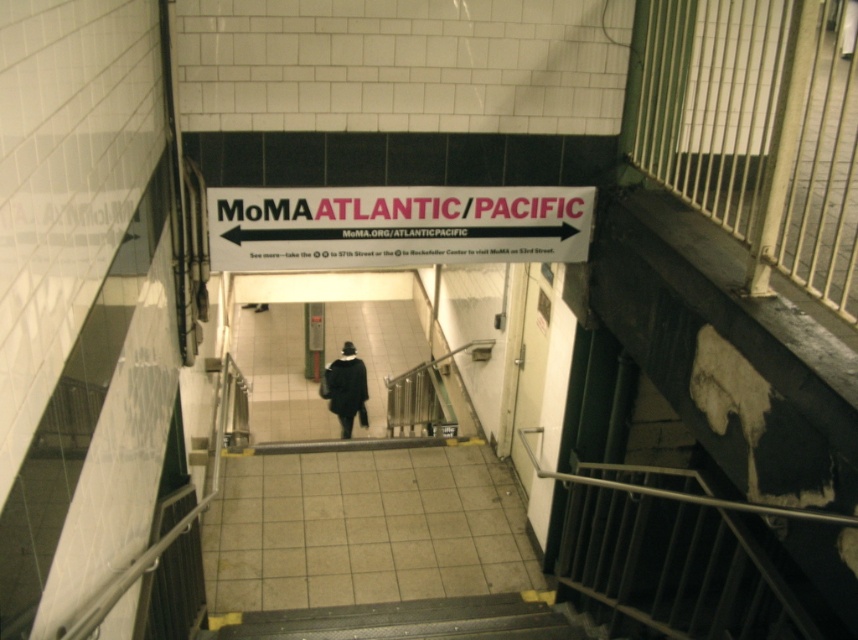
Who is more forward, (x=336, y=209) or (x=341, y=435)?

Point (x=336, y=209) is more forward.

Who is more forward, (x=429, y=248) or (x=333, y=392)?

Positioned in front is point (x=429, y=248).

At what (x,y) coordinates should I click in order to perform the action: click on white/black plastic sign at upper center. Please return your answer as a coordinate pair (x, y). This screenshot has height=640, width=858. Looking at the image, I should click on (394, 227).